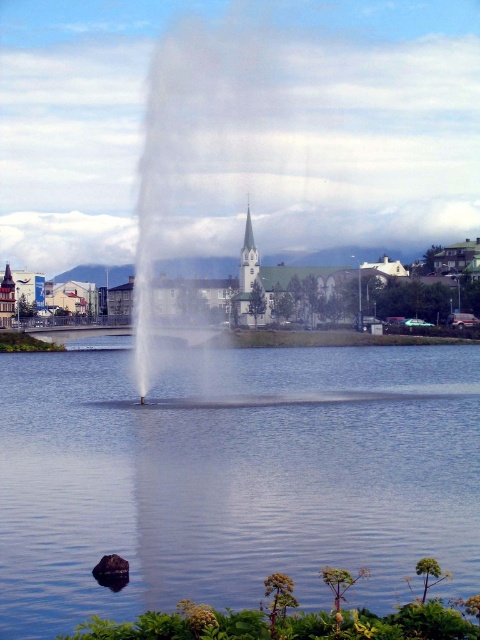
You are standing at the lakeside and want to take a photo of both the fountain and the church. The fountain is located at point [409,506] and the church is at point [240,317]. Since you want both to be in focus, which point should you focus on to ensure both are clear?

You should focus on point [240,317] because it is farther from the camera than point [409,506]. By focusing on the farther point, the closer point will also be within the depth of field, ensuring both the fountain and the church are in focus.

You are a tourist standing at the lakeside and want to take a photo of the white stone spire at center and the transparent water at center. Which object should you focus on first if you want to capture both in a single frame without moving the camera?

You should focus on the white stone spire at center first because the transparent water at center is positioned to its left, so adjusting the camera to include both would require ensuring the spire is centered while the water remains within the frame to the left.

You are standing on the lakeside and see the transparent water at center and the white stone spire at center. Which object is taller from your viewpoint?

The white stone spire at center is taller than the transparent water at center, so the white stone spire at center is taller.